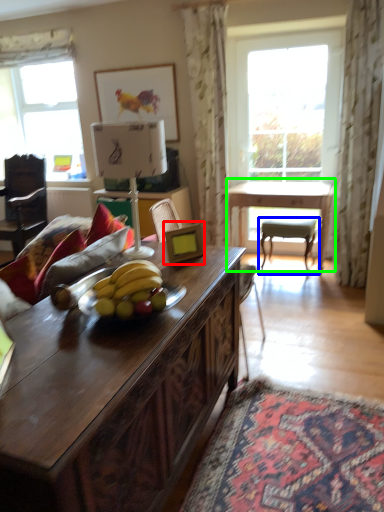
Question: Which object is positioned farthest from picture frame (highlighted by a red box)? Select from chair (highlighted by a blue box) and table (highlighted by a green box).

Choices:
 (A) chair
 (B) table

Answer: (A)